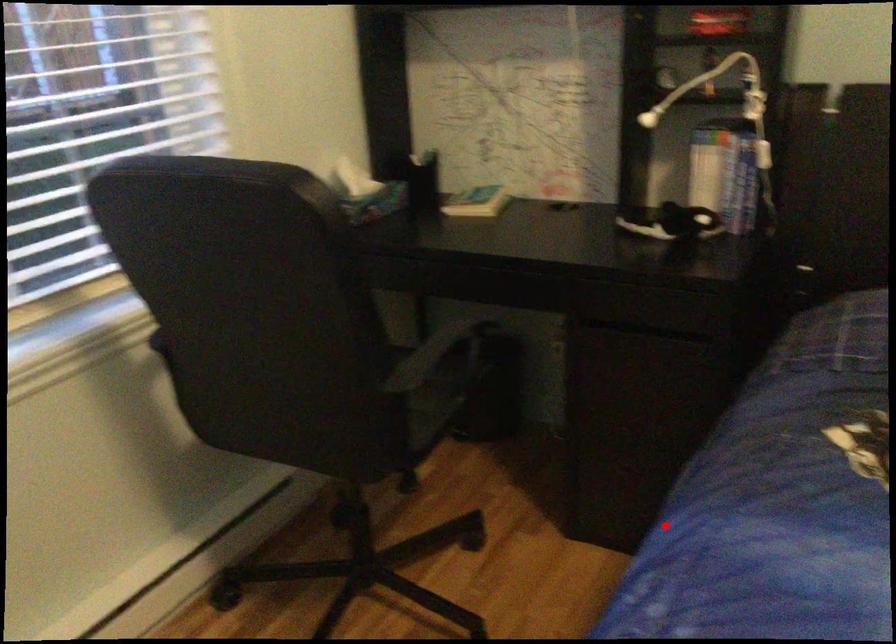
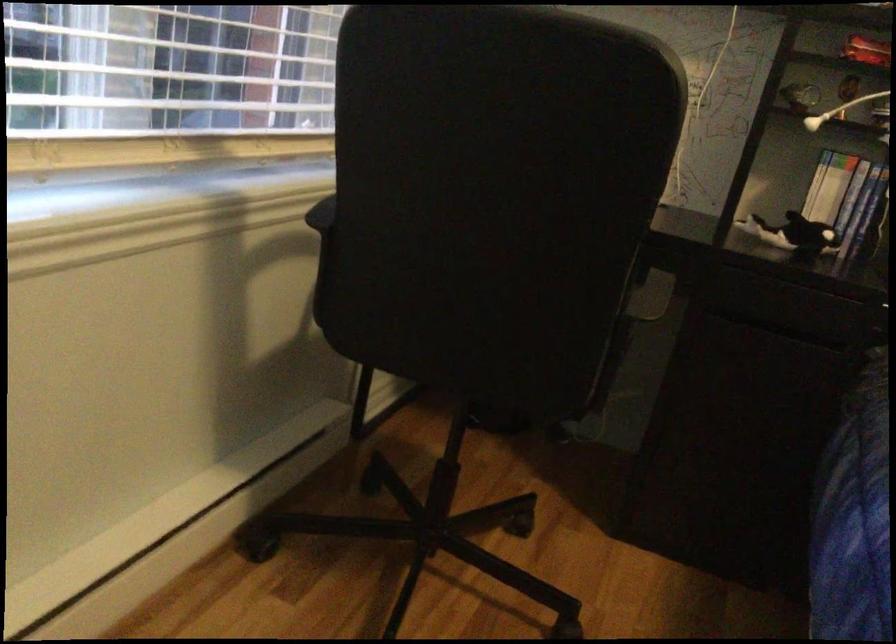
Find the pixel in the second image that matches the highlighted location in the first image.

(853, 518)